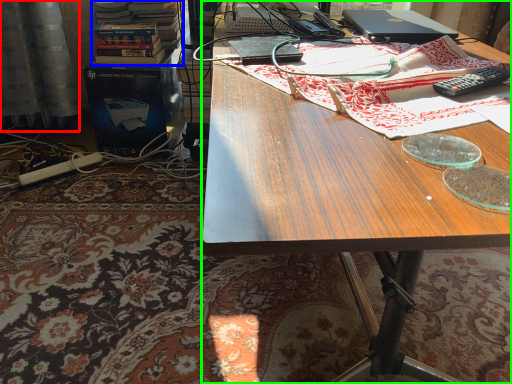
Question: Considering the real-world distances, which object is closest to curtain (highlighted by a red box)? book (highlighted by a blue box) or desk (highlighted by a green box).

Choices:
 (A) book
 (B) desk

Answer: (A)